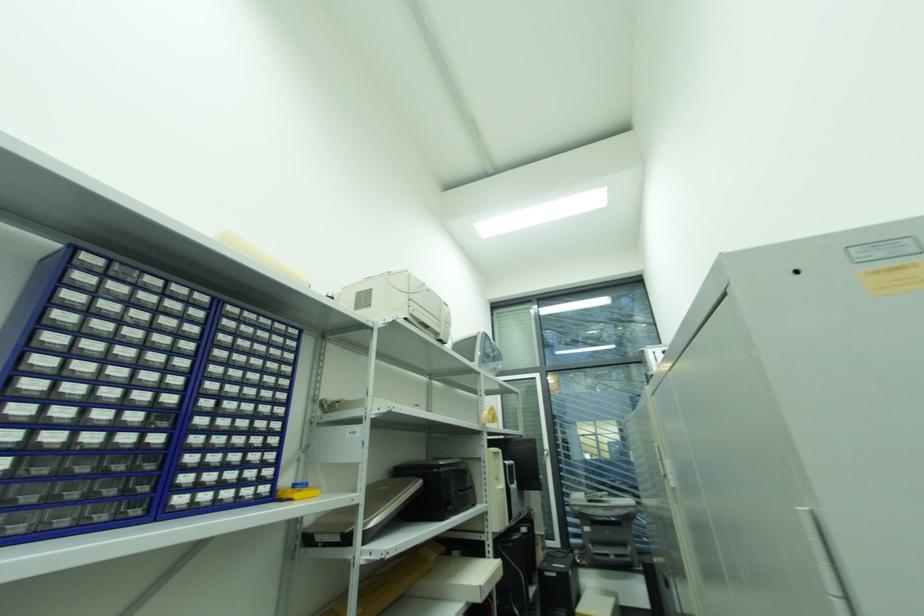
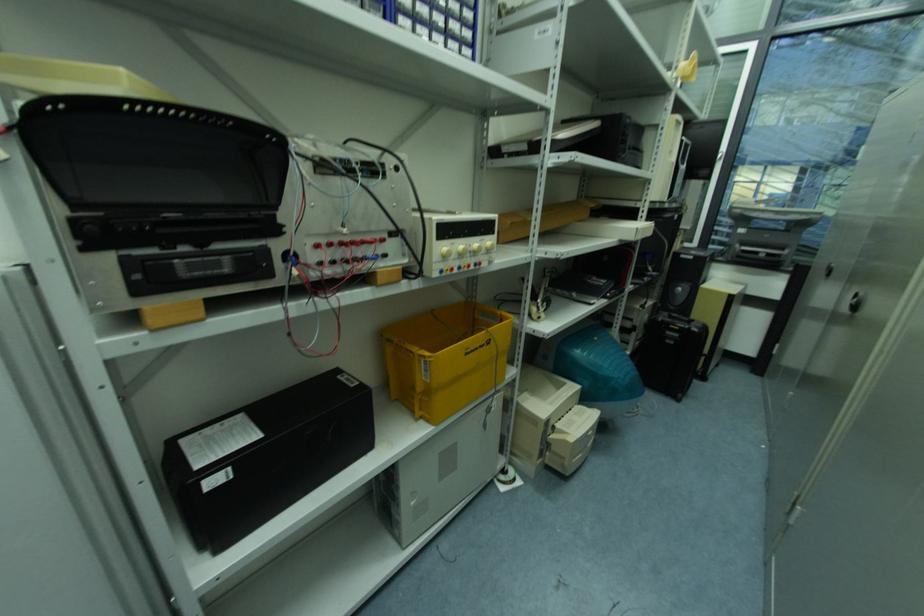
The images are taken continuously from a first-person perspective. In which direction is your viewpoint rotating?

The camera rotated toward left-down.